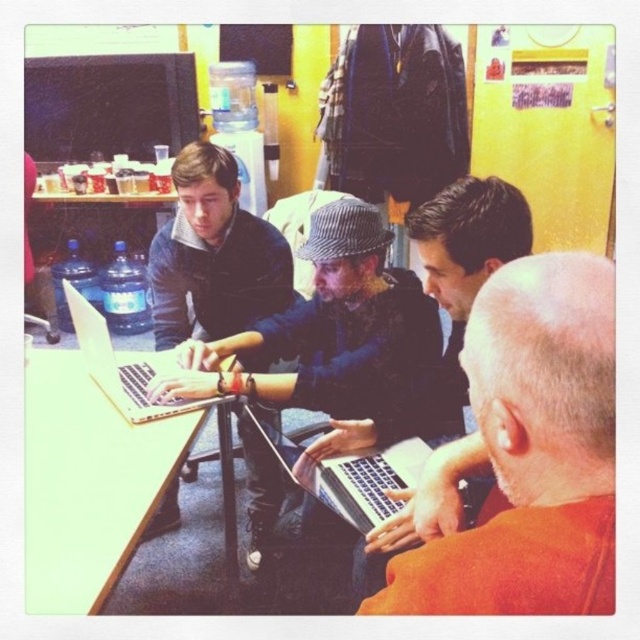
You are a delivery robot standing 1.5 meters away from the camera. You need to place a package on the matte black laptop at center. Can you reach it?

The matte black laptop at center is 1.46 meters away from the camera. Since you are 1.5 meters away from the camera, you are just slightly out of reach to place the package on the matte black laptop at center.

You are a photographer positioned in front of the scene. You want to capture a photo focusing on the orange matte shirt at lower right without the wooden table at lower left blocking the view. Is this possible based on their positions?

The orange matte shirt at lower right is closer to the viewer than the wooden table at lower left, so it will not be blocked by the table. You can capture the orange matte shirt at lower right without obstruction.

You are a person sitting at the table in the scene. You need to reach for the matte black laptop at center and the silver metallic laptop at center. Which one is closer to you?

The silver metallic laptop at center is closer to you because the matte black laptop at center is located above it, meaning the silver one is positioned lower and nearer to your reach.